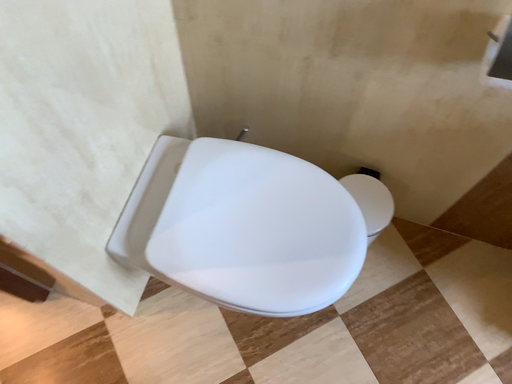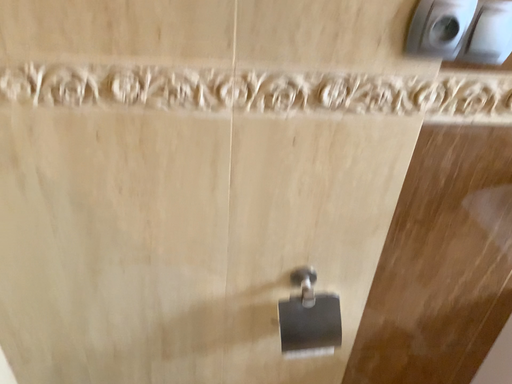
Question: Which way did the camera rotate in the video?

Choices:
 (A) rotated right
 (B) rotated left

Answer: (A)